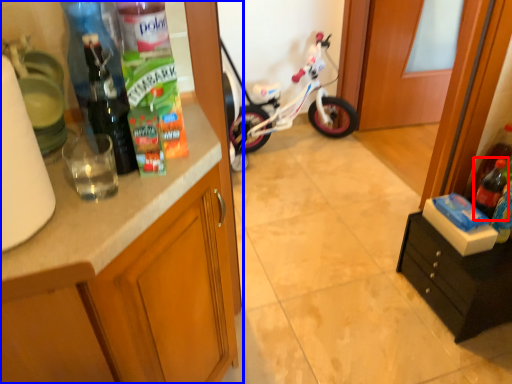
Question: Which of the following is the farthest to the observer, bottle (highlighted by a red box) or cabinetry (highlighted by a blue box)?

Choices:
 (A) bottle
 (B) cabinetry

Answer: (A)